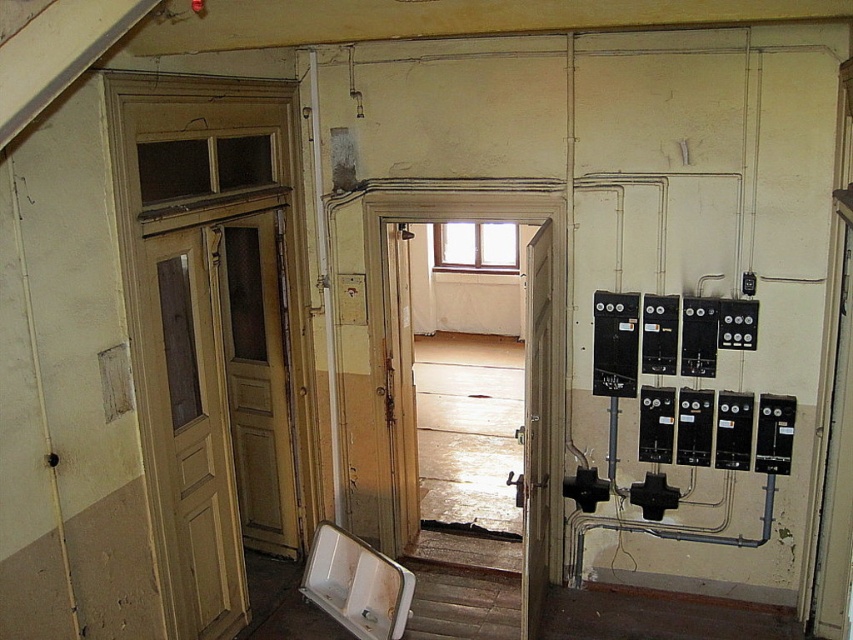
Question: Can you confirm if light wood paneling at left is positioned to the right of white matte urinal at lower center?

Choices:
 (A) yes
 (B) no

Answer: (B)

Question: Which point is closer to the camera taking this photo?

Choices:
 (A) (537, 628)
 (B) (170, 300)
 (C) (323, 561)

Answer: (B)

Question: Is light wood paneling at left positioned before white matte urinal at lower center?

Choices:
 (A) no
 (B) yes

Answer: (B)

Question: Can you confirm if matte wood door at center is positioned to the right of white matte urinal at lower center?

Choices:
 (A) yes
 (B) no

Answer: (A)

Question: Which point is farther to the camera?

Choices:
 (A) matte wood door at center
 (B) light wood paneling at left
 (C) white matte urinal at lower center

Answer: (C)

Question: Which of the following is the farthest from the observer?

Choices:
 (A) (537, 241)
 (B) (190, 460)
 (C) (381, 580)

Answer: (C)